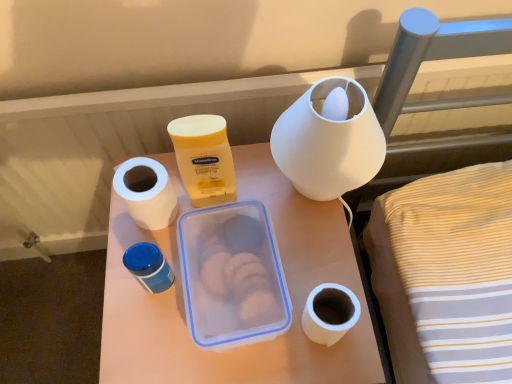
Locate an element on the screen. The width and height of the screenshot is (512, 384). free spot behind white matte toilet paper at lower right is located at coordinates (307, 242).